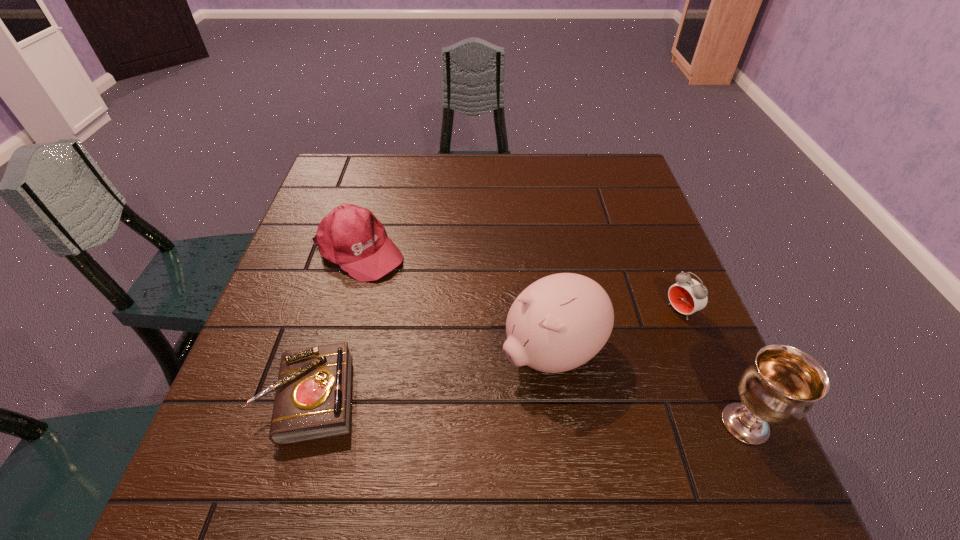
At what (x,y) coordinates should I click in order to perform the action: click on the shortest object. Please return your answer as a coordinate pair (x, y). Looking at the image, I should click on (313, 393).

At what (x,y) coordinates should I click in order to perform the action: click on chalice. Please return your answer as a coordinate pair (x, y). This screenshot has width=960, height=540. Looking at the image, I should click on (781, 385).

At what (x,y) coordinates should I click in order to perform the action: click on the farthest object. Please return your answer as a coordinate pair (x, y). This screenshot has width=960, height=540. Looking at the image, I should click on (350, 236).

Find the location of a particular element. This screenshot has height=540, width=960. piggy bank is located at coordinates (558, 323).

You are a GUI agent. You are given a task and a screenshot of the screen. Output one action in this format:
    pyautogui.click(x=<x>, y=<y>)
    Task: Click on the alarm clock
    
    Given the screenshot: What is the action you would take?
    pyautogui.click(x=687, y=296)

The image size is (960, 540). Identify the location of free space located on the right of the shortest object. (461, 397).

In order to click on free space located 0.170m on the back of the chalice in this screenshot , I will do `click(702, 325)`.

Where is `vacant space located 0.100m at the front of the farthest object with the brim`? This screenshot has width=960, height=540. vacant space located 0.100m at the front of the farthest object with the brim is located at coordinates (417, 294).

I want to click on free space located 0.120m at the front of the farthest object with the brim, so click(x=423, y=299).

Where is `vacant point located at the front of the farthest object with the brim`? This screenshot has width=960, height=540. vacant point located at the front of the farthest object with the brim is located at coordinates (414, 292).